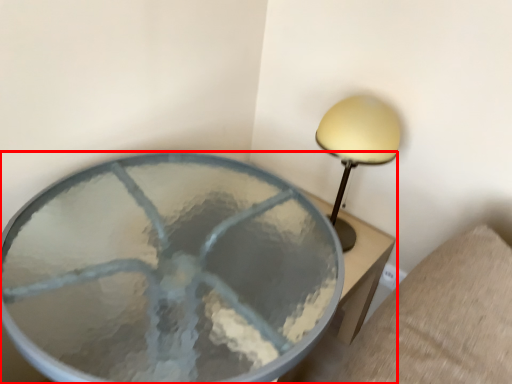
Question: From the image, what is the correct spatial relationship of table (annotated by the red box) in relation to lamp?

Choices:
 (A) left
 (B) right

Answer: (A)